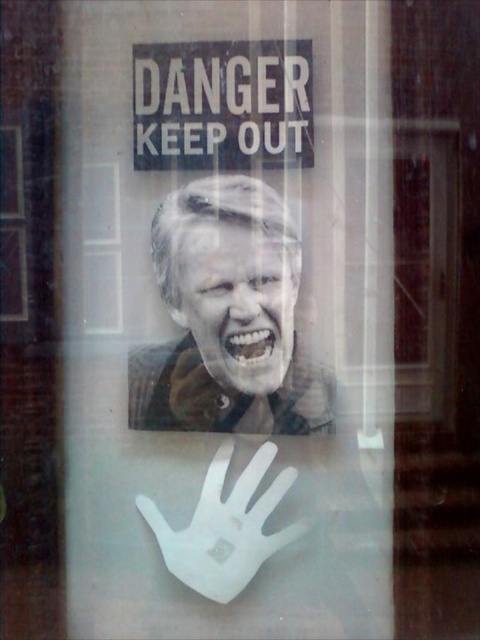
You are an architect designing a new building and want to place a black plastic sign at upper center similar to the one in the image. What coordinates should you use for its 2D location?

The 2D location of the black plastic sign at upper center should be placed at point (223, 104).

You are an inspector evaluating the window scene. The smooth brown leather jacket at center is part of the image. Based on its position, can you determine if it is closer to the top of the window or the bottom?

The smooth brown leather jacket at center is located at point 0.477 vertically, which is closer to the bottom of the window since the vertical coordinate ranges from 0 at the bottom to 1 at the top. Since 0.477 is less than 0.5, it is closer to the bottom.

You are a security guard inspecting the window. You notice the smooth brown leather jacket at center and the black plastic sign at upper center. Which object is positioned higher up on the window?

The black plastic sign at upper center is positioned higher up on the window than the smooth brown leather jacket at center.